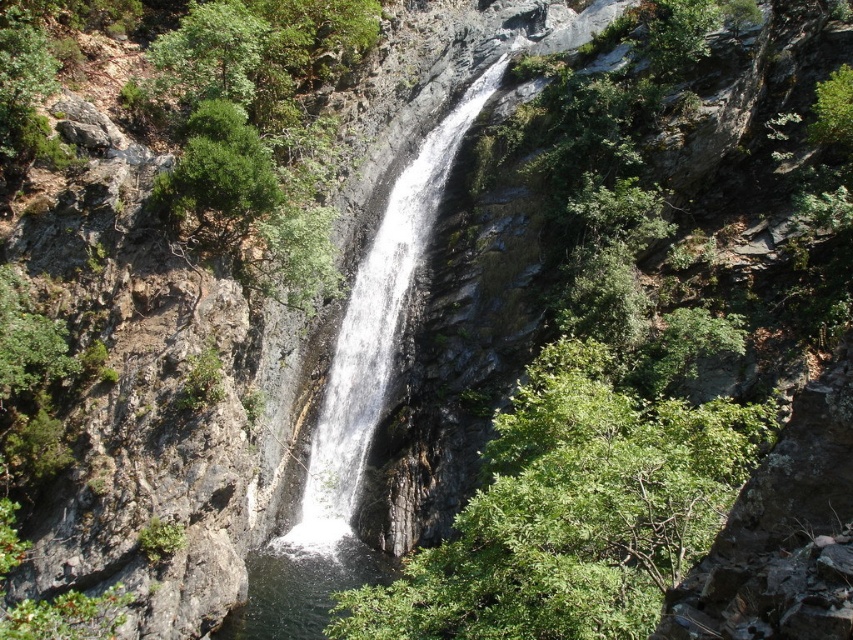
Question: Is white frothy water at center below clear water at center?

Choices:
 (A) no
 (B) yes

Answer: (A)

Question: Which point appears closest to the camera in this image?

Choices:
 (A) (322, 588)
 (B) (418, 193)

Answer: (A)

Question: Does white frothy water at center have a lesser width compared to clear water at center?

Choices:
 (A) no
 (B) yes

Answer: (A)

Question: Which of the following is the farthest from the observer?

Choices:
 (A) clear water at center
 (B) white frothy water at center

Answer: (B)

Question: Can you confirm if white frothy water at center is thinner than clear water at center?

Choices:
 (A) yes
 (B) no

Answer: (B)

Question: Which point is closer to the camera?

Choices:
 (A) white frothy water at center
 (B) clear water at center

Answer: (B)